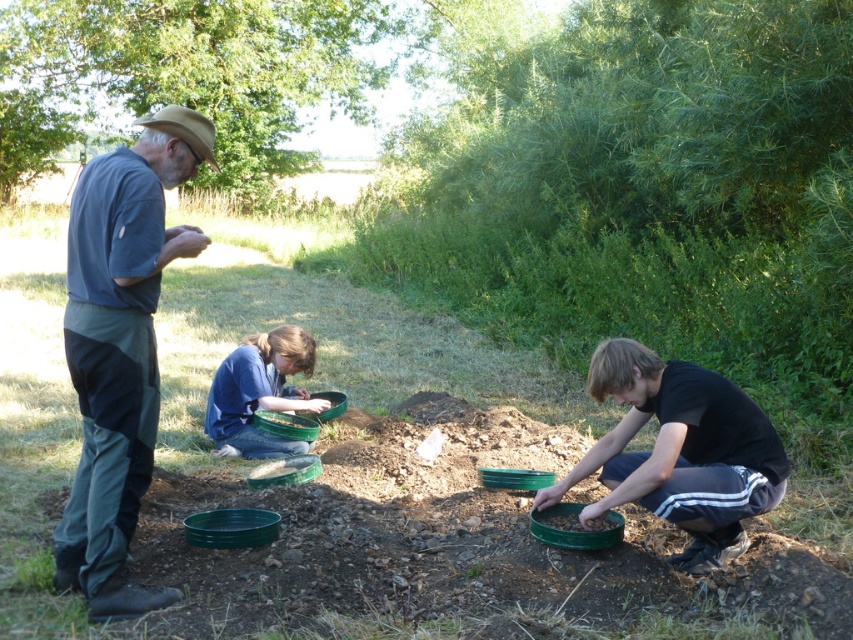
You are standing at the center of the image. You want to place a new item at the point marked as point [680,451]. What object is currently located there?

The black matte bowl at lower right is located at point [680,451].

You are a photographer trying to capture a clear shot of both the blue fabric shirt at left and the black matte bowl at lower right. Based on their positions, which object is closer to the camera?

The blue fabric shirt at left is above the black matte bowl at lower right, meaning it is closer to the camera.